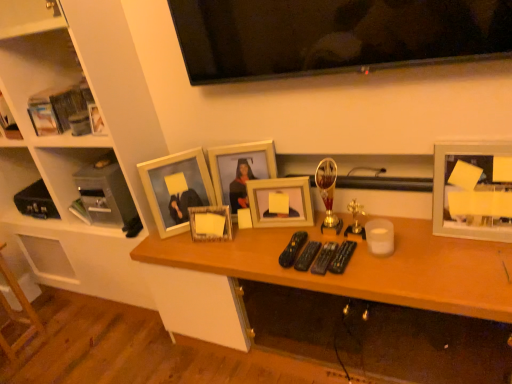
Where is `vacant area that is situated to the right of wooden picture frame at center, which is the second picture frame from left to right`? This screenshot has width=512, height=384. vacant area that is situated to the right of wooden picture frame at center, which is the second picture frame from left to right is located at coordinates (257, 236).